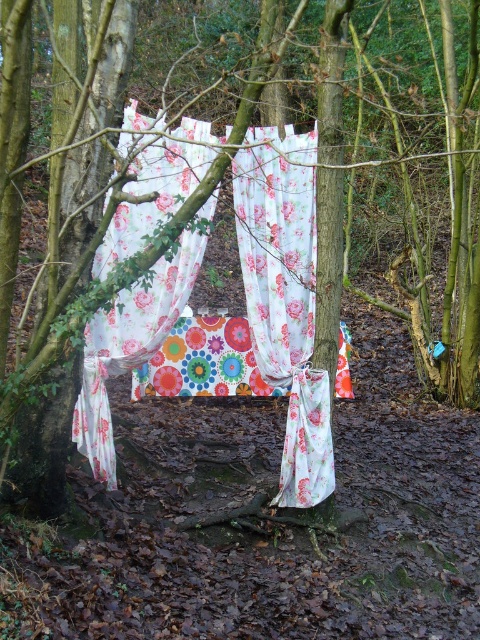
You are setting up a photoshoot in the woods and have both the floral fabric curtain at center and the floral fabric tent at center. Which one would you choose if you want to cover a larger area for the backdrop?

The floral fabric tent at center should be chosen because it occupies more space than the floral fabric curtain at center, making it suitable for covering a larger area as a backdrop.

You are a photographer setting up a photoshoot in this wooded area. You have a camera that requires a minimum of 24 inches between the floral fabric curtain at center and the floral fabric tent at center to capture both in a single shot. Based on the scene description, can you fit both objects within the camera frame?

The distance between the floral fabric curtain at center and the floral fabric tent at center is 20.88 inches, which is less than the required 24 inches. Therefore, you cannot fit both objects within the camera frame.